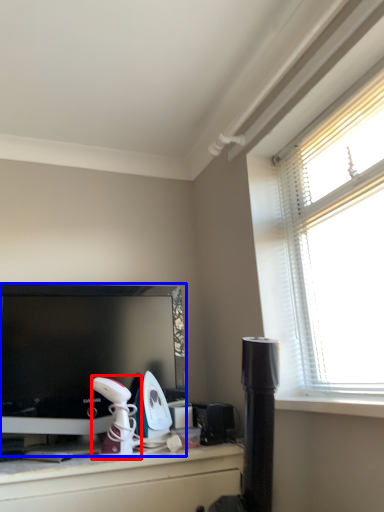
Question: Which of the following is the farthest to the observer, appliance (highlighted by a red box) or television (highlighted by a blue box)?

Choices:
 (A) appliance
 (B) television

Answer: (B)